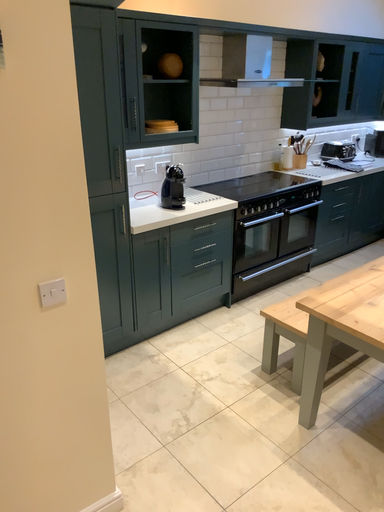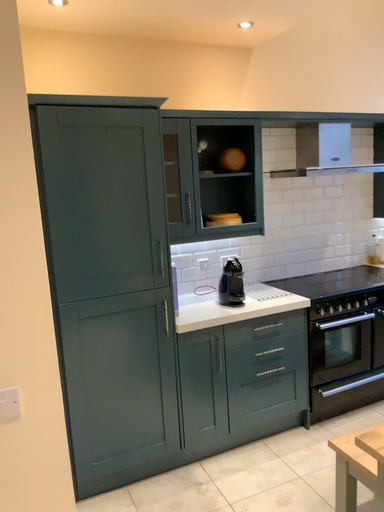
Question: Which way did the camera rotate in the video?

Choices:
 (A) rotated downward
 (B) rotated upward

Answer: (B)